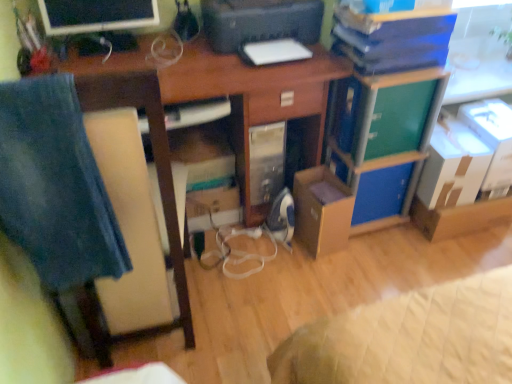
Where is `vacant space in matte black monitor at upper left (from a real-world perspective)`? The width and height of the screenshot is (512, 384). vacant space in matte black monitor at upper left (from a real-world perspective) is located at coordinates (106, 43).